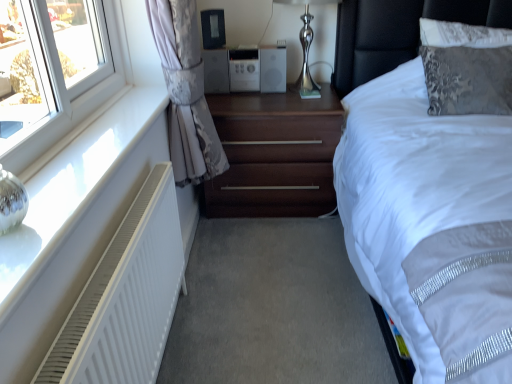
Question: Is white matte radiator at lower left facing towards white matte radiator at left?

Choices:
 (A) yes
 (B) no

Answer: (B)

Question: From a real-world perspective, is white matte radiator at lower left beneath white matte radiator at left?

Choices:
 (A) yes
 (B) no

Answer: (B)

Question: Can you confirm if white matte radiator at lower left is bigger than white matte radiator at left?

Choices:
 (A) no
 (B) yes

Answer: (A)

Question: Is white matte radiator at lower left shorter than white matte radiator at left?

Choices:
 (A) yes
 (B) no

Answer: (A)

Question: Are white matte radiator at lower left and white matte radiator at left far apart?

Choices:
 (A) no
 (B) yes

Answer: (A)

Question: From a real-world perspective, is white matte radiator at lower left on white matte radiator at left?

Choices:
 (A) no
 (B) yes

Answer: (B)

Question: Is the position of dark wood nightstand at center less distant than that of white matte radiator at left?

Choices:
 (A) no
 (B) yes

Answer: (A)

Question: From the image's perspective, is dark wood nightstand at center below white matte radiator at left?

Choices:
 (A) no
 (B) yes

Answer: (A)

Question: Is dark wood nightstand at center located outside white matte radiator at left?

Choices:
 (A) no
 (B) yes

Answer: (B)

Question: Is dark wood nightstand at center taller than white matte radiator at left?

Choices:
 (A) yes
 (B) no

Answer: (B)

Question: Can you confirm if dark wood nightstand at center is positioned to the left of white matte radiator at left?

Choices:
 (A) yes
 (B) no

Answer: (B)

Question: From a real-world perspective, is dark wood nightstand at center located beneath white matte radiator at left?

Choices:
 (A) no
 (B) yes

Answer: (B)

Question: Does silver metallic stereo at center appear on the right side of black plastic speaker at upper center?

Choices:
 (A) yes
 (B) no

Answer: (A)